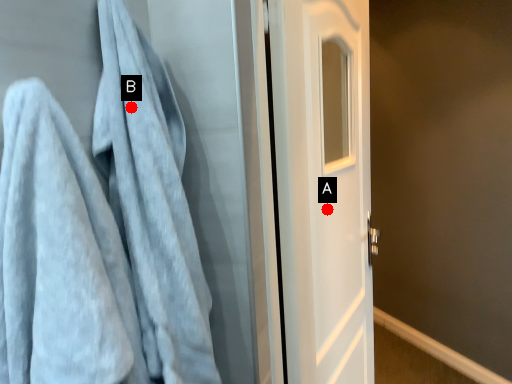
Question: Two points are circled on the image, labeled by A and B beside each circle. Among these points, which one is nearest to the camera?

Choices:
 (A) A is closer
 (B) B is closer

Answer: (B)